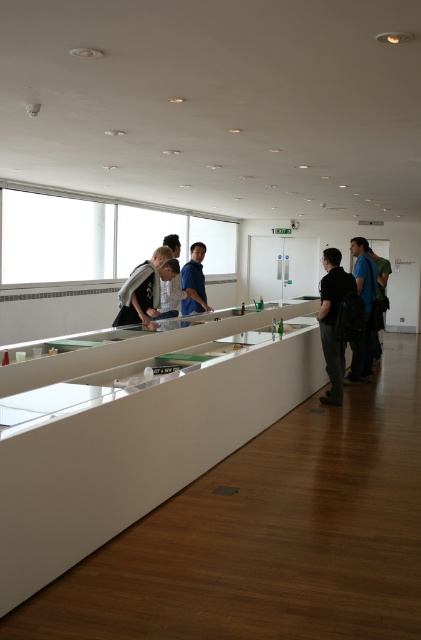
Who is taller, matte gray shirt at center or blue fabric shirt at right?

Standing taller between the two is blue fabric shirt at right.

The width and height of the screenshot is (421, 640). In order to click on matte gray shirt at center in this screenshot , I will do `click(144, 289)`.

What do you see at coordinates (140, 435) in the screenshot? I see `white glossy counter at center` at bounding box center [140, 435].

Find the location of `white glossy counter at center`. white glossy counter at center is located at coordinates (140, 435).

Which of these two, blue fabric shirt at right or blue shirt at center, stands shorter?

With less height is blue shirt at center.

Can you confirm if blue fabric shirt at right is wider than blue shirt at center?

Correct, the width of blue fabric shirt at right exceeds that of blue shirt at center.

Is point (367, 260) in front of point (204, 284)?

That is True.

Image resolution: width=421 pixels, height=640 pixels. Identify the location of blue fabric shirt at right. (365, 310).